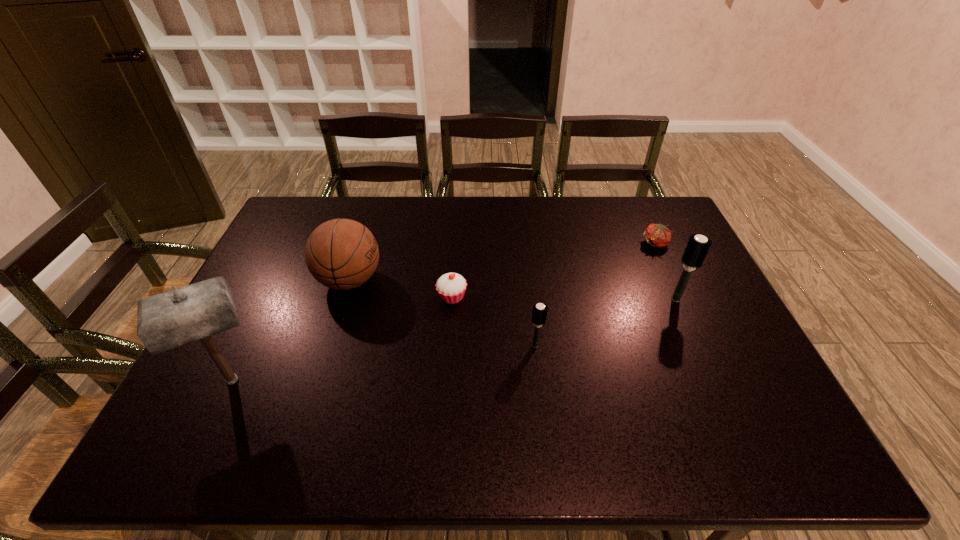
I want to click on hairbrush positioned at the right edge, so click(x=697, y=248).

Find the location of a particular element. tomato located in the right edge section of the desktop is located at coordinates (657, 235).

Image resolution: width=960 pixels, height=540 pixels. In order to click on object that is at the near left corner in this screenshot , I will do `click(171, 319)`.

I want to click on object located in the far right corner section of the desktop, so click(x=657, y=235).

I want to click on vacant space at the far edge of the desktop, so click(x=371, y=232).

This screenshot has width=960, height=540. Identify the location of vacant space at the near edge of the desktop. (511, 383).

This screenshot has height=540, width=960. Identify the location of vacant space at the left edge. (237, 344).

This screenshot has width=960, height=540. Find the location of `vacant space at the right edge of the desktop`. vacant space at the right edge of the desktop is located at coordinates (718, 359).

In the image, there is a desktop. Where is `vacant space at the far left corner`? This screenshot has width=960, height=540. vacant space at the far left corner is located at coordinates (327, 209).

In order to click on free region at the near left corner of the desktop in this screenshot , I will do `click(250, 400)`.